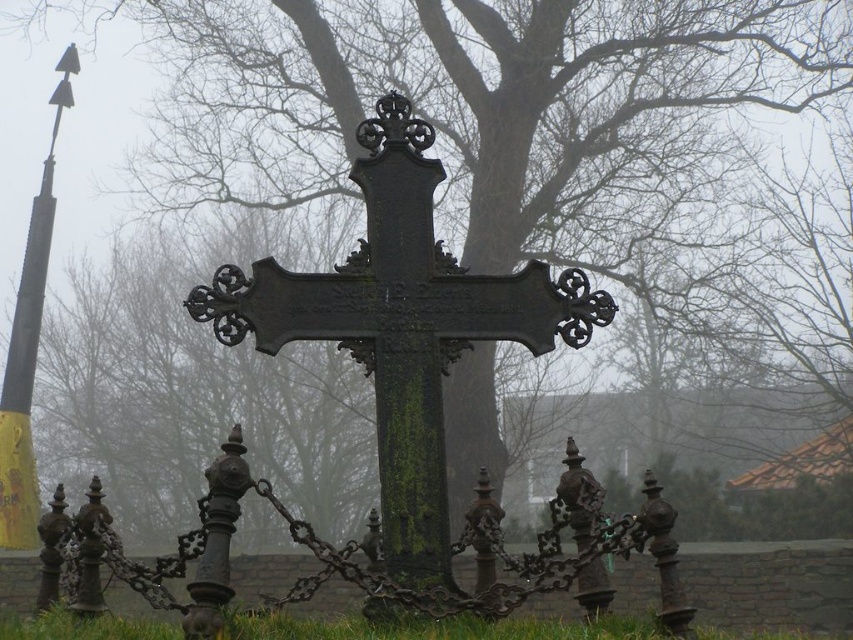
Question: Does green mossy metal cross at center appear over green grass at lower center?

Choices:
 (A) no
 (B) yes

Answer: (B)

Question: Does green grass at lower center lie behind yellow painted metal pole at left?

Choices:
 (A) yes
 (B) no

Answer: (B)

Question: Among these objects, which one is nearest to the camera?

Choices:
 (A) green mossy metal cross at center
 (B) rusty metal fence at center

Answer: (A)

Question: Which of the following is the farthest from the observer?

Choices:
 (A) (22, 330)
 (B) (527, 632)

Answer: (A)

Question: Can you confirm if green mossy metal cross at center is bigger than rusty metal fence at center?

Choices:
 (A) yes
 (B) no

Answer: (A)

Question: Which of these objects is positioned closest to the yellow painted metal pole at left?

Choices:
 (A) green mossy metal cross at center
 (B) rusty metal fence at center

Answer: (A)